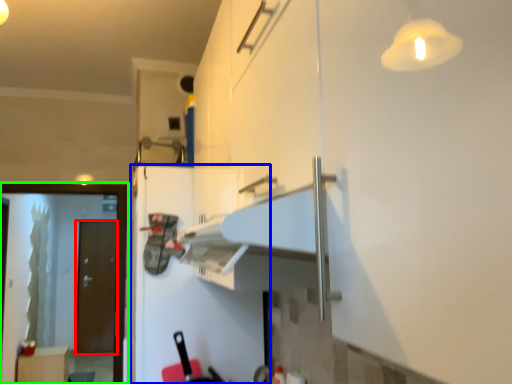
Question: Which object is the closest to the door (highlighted by a red box)? Choose among these: fridge (highlighted by a blue box) or screen door (highlighted by a green box).

Choices:
 (A) fridge
 (B) screen door

Answer: (B)